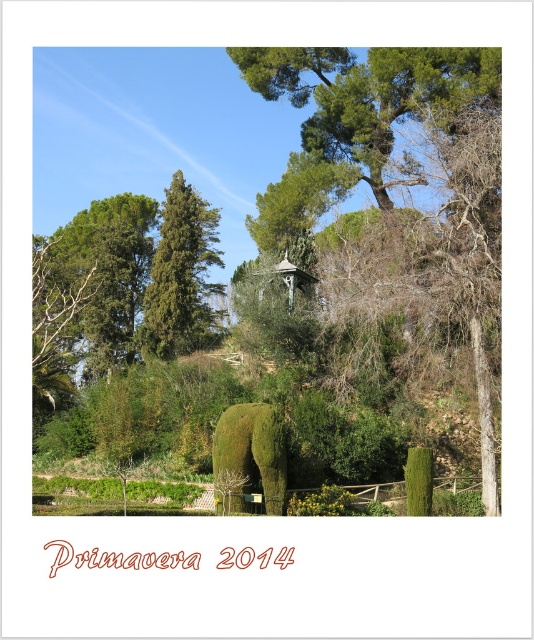
Between green leafy tree at upper left and green textured tree at center, which one is positioned higher?

green textured tree at center

Is green leafy tree at upper left to the right of green textured tree at center from the viewer's perspective?

In fact, green leafy tree at upper left is to the left of green textured tree at center.

In order to click on green leafy tree at upper left in this screenshot , I will do `click(108, 273)`.

Which of these two, green textured tree at center or green mossy elephant at center, stands taller?

green textured tree at center

Can you confirm if green textured tree at center is positioned below green mossy elephant at center?

Actually, green textured tree at center is above green mossy elephant at center.

Based on the photo, who is more distant from viewer, (x=187, y=182) or (x=247, y=452)?

Positioned behind is point (x=187, y=182).

You are a GUI agent. You are given a task and a screenshot of the screen. Output one action in this format:
    pyautogui.click(x=<x>, y=<y>)
    Task: Click on the green textured tree at center
    This screenshot has width=534, height=640.
    Given the screenshot: What is the action you would take?
    pyautogui.click(x=180, y=275)

Can you confirm if green leafy tree at center is bigger than green mossy elephant at center?

Yes.

Who is positioned more to the left, green leafy tree at center or green mossy elephant at center?

green leafy tree at center

Does point (412, 109) come behind point (253, 436)?

Yes, it is.

The width and height of the screenshot is (534, 640). Find the location of `green leafy tree at center`. green leafy tree at center is located at coordinates (359, 140).